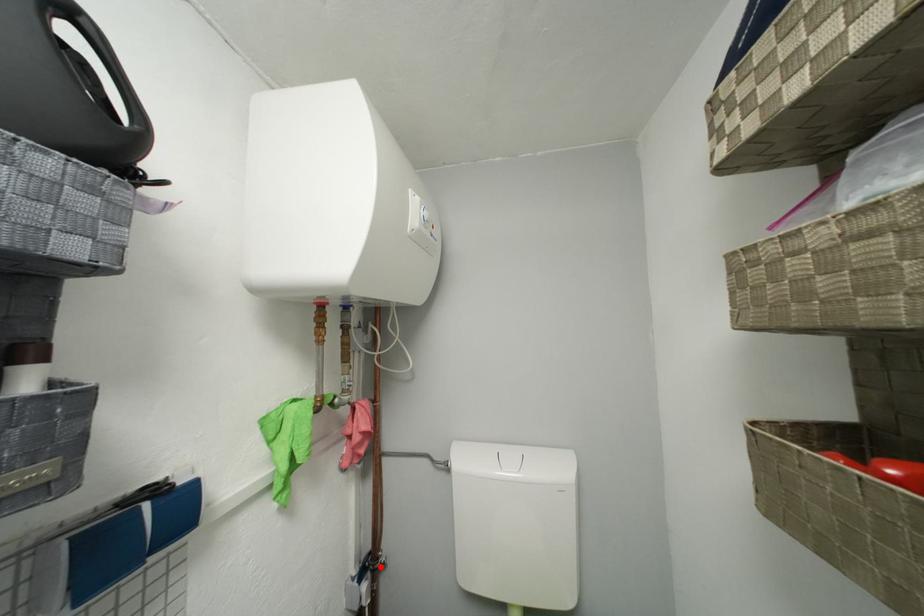
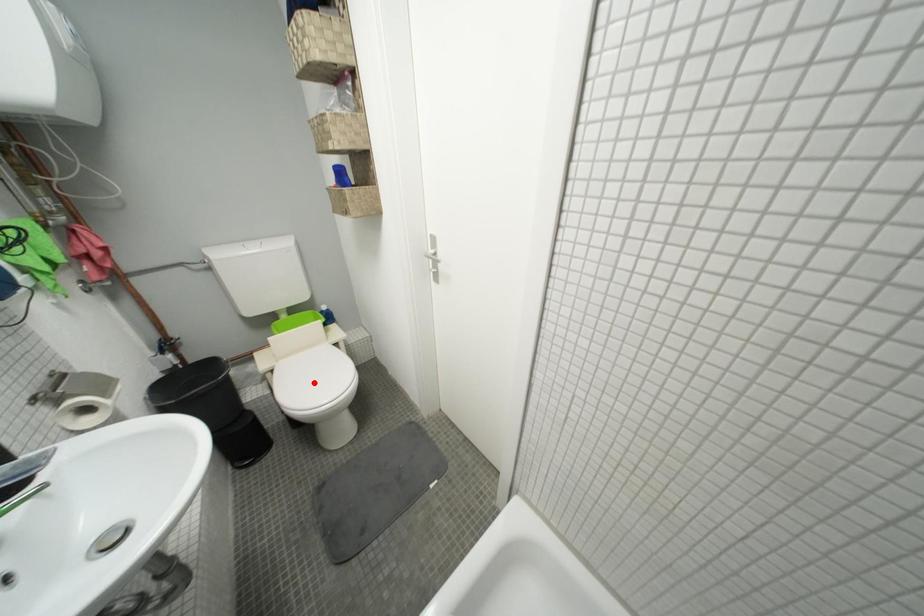
I am providing you with two images of the same scene from different viewpoints. A red point is marked on the first image and another point is marked on the second image. Is the red point in image1 aligned with the point shown in image2?

No